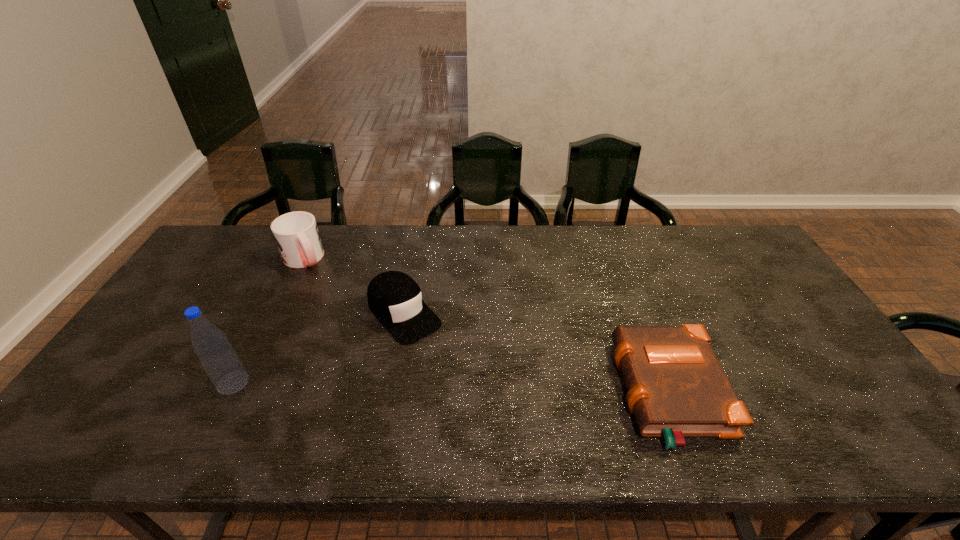
Find the location of a particular element. This screenshot has height=540, width=960. free spot that satisfies the following two spatial constraints: 1. on the front side of the rightmost object; 2. on the spine side of the cap is located at coordinates (390, 393).

At what (x,y) coordinates should I click in order to perform the action: click on free space in the image that satisfies the following two spatial constraints: 1. on the front side of the shortest object; 2. on the spine side of the water bottle. Please return your answer as a coordinate pair (x, y). This screenshot has width=960, height=540. Looking at the image, I should click on (228, 393).